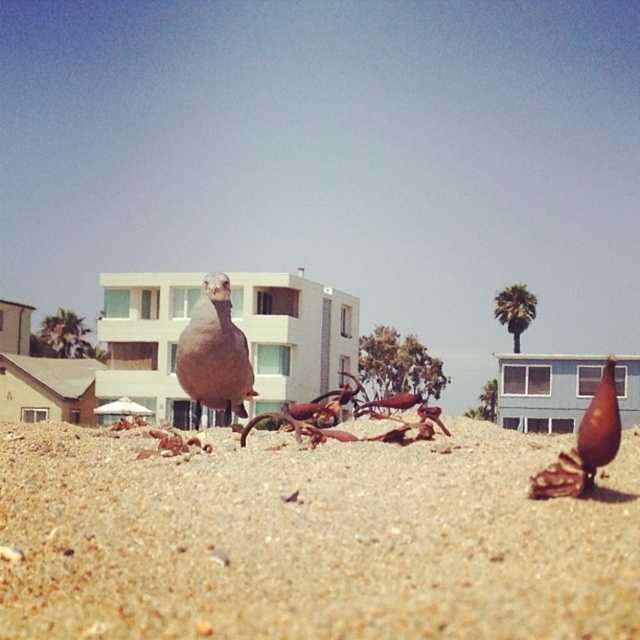
You are a photographer trying to capture both the brown sandy beach at center and the brown matte bird at center in a single frame. Based on their sizes, which object should you focus on first to ensure they both fit in the photo?

The brown sandy beach at center is narrower than the brown matte bird at center, so focusing on the bird first will help ensure both fit in the frame.